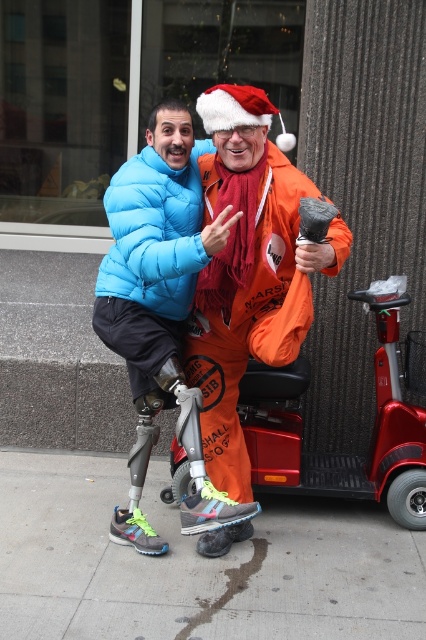
Question: Is gray concrete sidewalk at center wider than orange fabric santa hat at center?

Choices:
 (A) yes
 (B) no

Answer: (A)

Question: Can you confirm if gray concrete sidewalk at center is smaller than blue puffer jacket at center?

Choices:
 (A) no
 (B) yes

Answer: (A)

Question: Which point appears farthest from the camera in this image?

Choices:
 (A) (233, 250)
 (B) (74, 461)
 (C) (169, 324)

Answer: (B)

Question: Which point appears farthest from the camera in this image?

Choices:
 (A) (221, 323)
 (B) (402, 531)

Answer: (B)

Question: In this image, where is orange fabric santa hat at center located relative to blue puffer jacket at center?

Choices:
 (A) right
 (B) left

Answer: (A)

Question: Based on their relative distances, which object is farther from the orange fabric santa hat at center?

Choices:
 (A) blue puffer jacket at center
 (B) gray concrete sidewalk at center

Answer: (B)